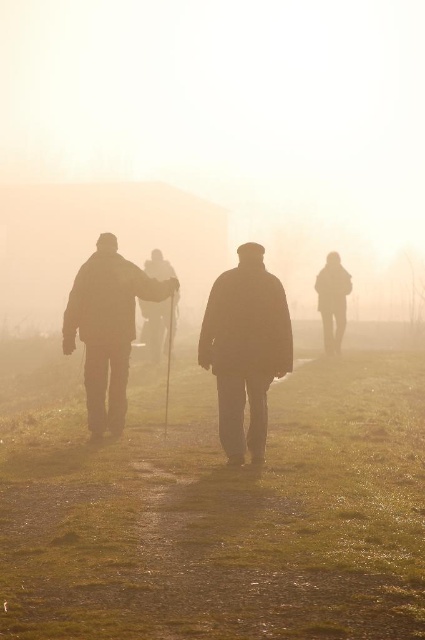
Can you confirm if green grassy at center is thinner than silhouette wooden cane at center?

In fact, green grassy at center might be wider than silhouette wooden cane at center.

Is point (382, 353) positioned before point (110, 234)?

No.

Find the location of a particular element. This screenshot has height=640, width=425. green grassy at center is located at coordinates (223, 515).

Is silhouette coat at center closer to the viewer compared to silhouette wooden cane at center?

Yes, silhouette coat at center is in front of silhouette wooden cane at center.

You are a GUI agent. You are given a task and a screenshot of the screen. Output one action in this format:
    pyautogui.click(x=<x>, y=<y>)
    Task: Click on the silhouette coat at center
    The height and width of the screenshot is (640, 425).
    Given the screenshot: What is the action you would take?
    pyautogui.click(x=246, y=348)

Does point (251, 499) come closer to viewer compared to point (238, 323)?

Yes, it is in front of point (238, 323).

Can you confirm if green grassy at center is shorter than silhouette coat at center?

Indeed, green grassy at center has a lesser height compared to silhouette coat at center.

Where is `green grassy at center`? The height and width of the screenshot is (640, 425). green grassy at center is located at coordinates (223, 515).